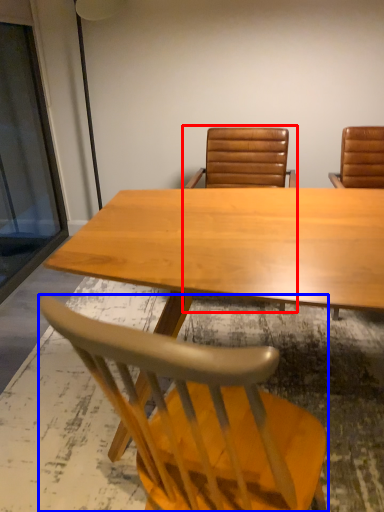
Question: Which point is closer to the camera, chair (highlighted by a red box) or chair (highlighted by a blue box)?

Choices:
 (A) chair
 (B) chair

Answer: (B)